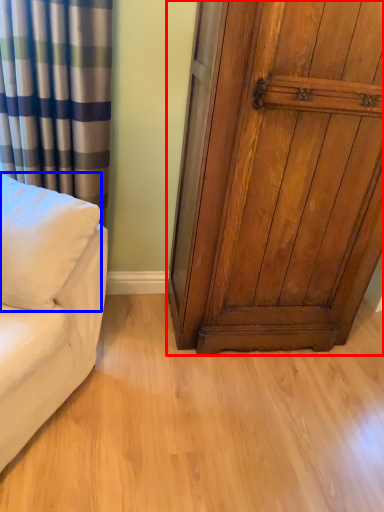
Question: Which object appears farthest to the camera in this image, door (highlighted by a red box) or pillow (highlighted by a blue box)?

Choices:
 (A) door
 (B) pillow

Answer: (A)